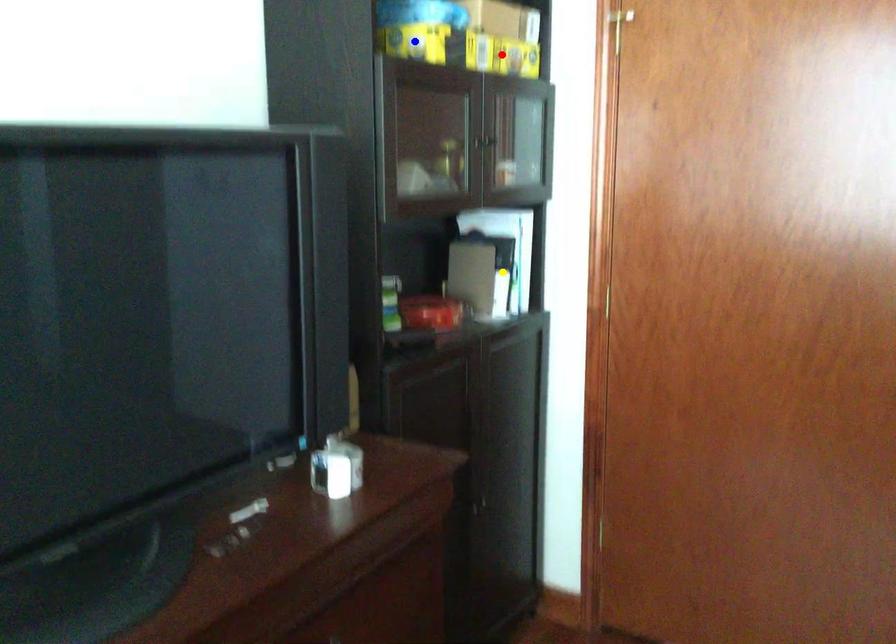
Order these from nearest to farthest:
blue point | yellow point | red point

yellow point < red point < blue point